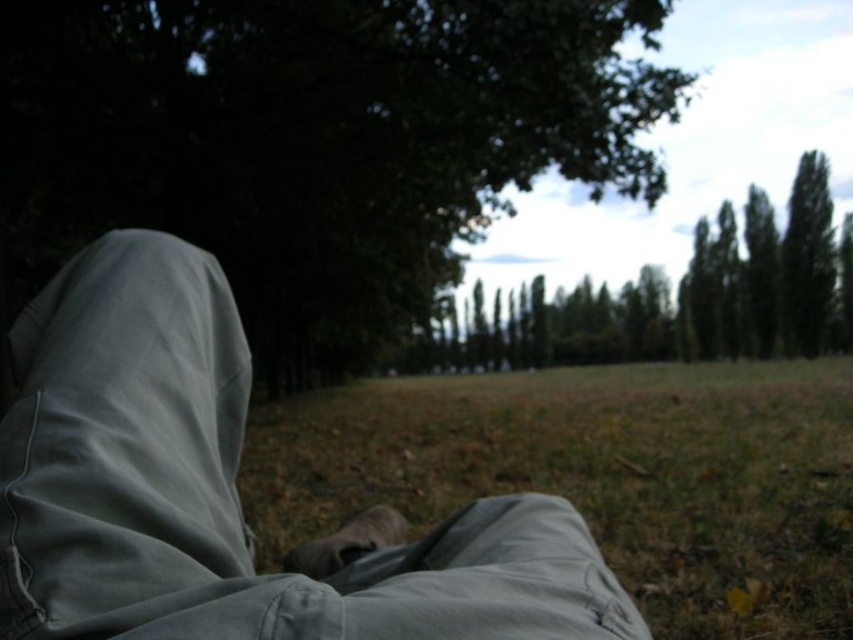
Question: Estimate the real-world distances between objects in this image. Which object is closer to the green grass at lower center?

Choices:
 (A) light gray pants at center
 (B) green leafy tree at center

Answer: (A)

Question: Does green grass at lower center appear under green leafy tree at center?

Choices:
 (A) yes
 (B) no

Answer: (A)

Question: Is green grass at lower center closer to the viewer compared to green leafy tree at center?

Choices:
 (A) yes
 (B) no

Answer: (A)

Question: Estimate the real-world distances between objects in this image. Which object is farther from the green leafy tree at upper left?

Choices:
 (A) light gray pants at center
 (B) green leafy tree at center

Answer: (B)

Question: Considering the relative positions of green leafy tree at upper left and green leafy tree at center in the image provided, where is green leafy tree at upper left located with respect to green leafy tree at center?

Choices:
 (A) above
 (B) below

Answer: (B)

Question: Which point is closer to the camera taking this photo?

Choices:
 (A) (88, 10)
 (B) (91, 355)

Answer: (B)